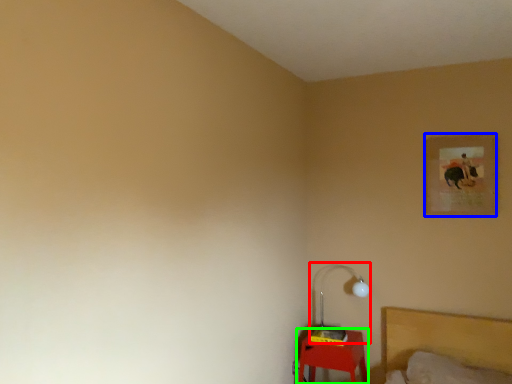
Question: Which is nearer to the lamp (highlighted by a red box)? picture frame (highlighted by a blue box) or furniture (highlighted by a green box).

Choices:
 (A) picture frame
 (B) furniture

Answer: (B)